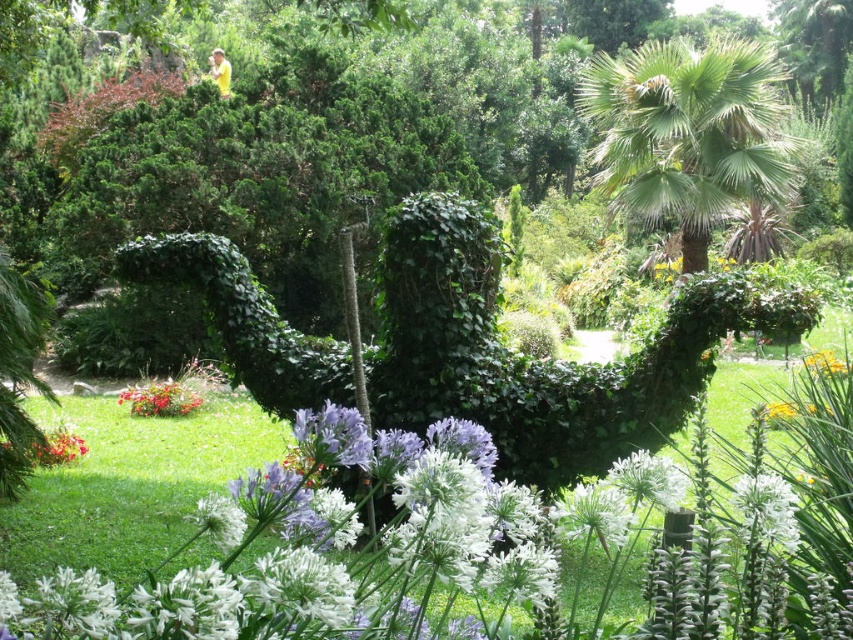
Does vivid red petals at lower center have a greater width compared to yellow/yellowish-green/yellow-green/yellowish/green/yellow-green/yellow/green/yellow-green/yellow/yellow-green/yellow/yellow-green/yellow/yellow-green/yellow/yellow-green/yellow/yellow-green/yellow/yellow-green/yellow/yellow-green/yellow/yellow-green/yellow/yellow-green/yellow/yellow-green/yellow/yellow-green/yellow/yellow-green/yellow/yellow-green/yellow/yellow-green/yellow/yellow-green/yellow/yellow-green/yellow/yellow-green/yellow/yellow-green/yellow/yellow-green/yellow/yellow-green/yellow/yellow-green?

No, vivid red petals at lower center is not wider than yellow/yellowish-green/yellow-green/yellowish/green/yellow-green/yellow/green/yellow-green/yellow/yellow-green/yellow/yellow-green/yellow/yellow-green/yellow/yellow-green/yellow/yellow-green/yellow/yellow-green/yellow/yellow-green/yellow/yellow-green/yellow/yellow-green/yellow/yellow-green/yellow/yellow-green/yellow/yellow-green/yellow/yellow-green/yellow/yellow-green/yellow/yellow-green/yellow/yellow-green/yellow/yellow-green/yellow/yellow-green/yellow/yellow-green/yellow/yellow-green/yellow/yellow-green.

Does vivid red petals at lower center have a greater height compared to yellow/yellowish-green/yellow-green/yellowish/green/yellow-green/yellow/green/yellow-green/yellow/yellow-green/yellow/yellow-green/yellow/yellow-green/yellow/yellow-green/yellow/yellow-green/yellow/yellow-green/yellow/yellow-green/yellow/yellow-green/yellow/yellow-green/yellow/yellow-green/yellow/yellow-green/yellow/yellow-green/yellow/yellow-green/yellow/yellow-green/yellow/yellow-green/yellow/yellow-green/yellow/yellow-green/yellow/yellow-green/yellow/yellow-green/yellow/yellow-green/yellow/yellow-green?

No, vivid red petals at lower center is not taller than yellow/yellowish-green/yellow-green/yellowish/green/yellow-green/yellow/green/yellow-green/yellow/yellow-green/yellow/yellow-green/yellow/yellow-green/yellow/yellow-green/yellow/yellow-green/yellow/yellow-green/yellow/yellow-green/yellow/yellow-green/yellow/yellow-green/yellow/yellow-green/yellow/yellow-green/yellow/yellow-green/yellow/yellow-green/yellow/yellow-green/yellow/yellow-green/yellow/yellow-green/yellow/yellow-green/yellow/yellow-green/yellow/yellow-green/yellow/yellow-green/yellow/yellow-green.

Between point (155, 396) and point (843, 362), which one is positioned in front?

Point (155, 396) is in front.

Where is `vivid red petals at lower center`? The image size is (853, 640). vivid red petals at lower center is located at coordinates (160, 400).

Where is `green leafy palm at upper right`? Image resolution: width=853 pixels, height=640 pixels. green leafy palm at upper right is located at coordinates (688, 132).

Consider the image. Is green leafy palm at upper right taller than vivid red petals at lower center?

Yes.

Describe the element at coordinates (688, 132) in the screenshot. I see `green leafy palm at upper right` at that location.

The height and width of the screenshot is (640, 853). Find the location of `green leafy palm at upper right`. green leafy palm at upper right is located at coordinates (688, 132).

Between green leafy ivy at center and white matte flower at lower center, which one is positioned lower?

white matte flower at lower center is below.

Does green leafy ivy at center appear under white matte flower at lower center?

Actually, green leafy ivy at center is above white matte flower at lower center.

Which is in front, point (456, 218) or point (744, 528)?

Positioned in front is point (744, 528).

Identify the location of green leafy ivy at center. The width and height of the screenshot is (853, 640). (537, 358).